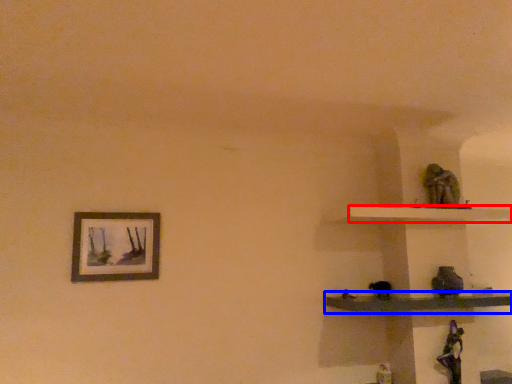
Question: Which of the following is the farthest to the observer, shelf (highlighted by a red box) or shelf (highlighted by a blue box)?

Choices:
 (A) shelf
 (B) shelf

Answer: (A)